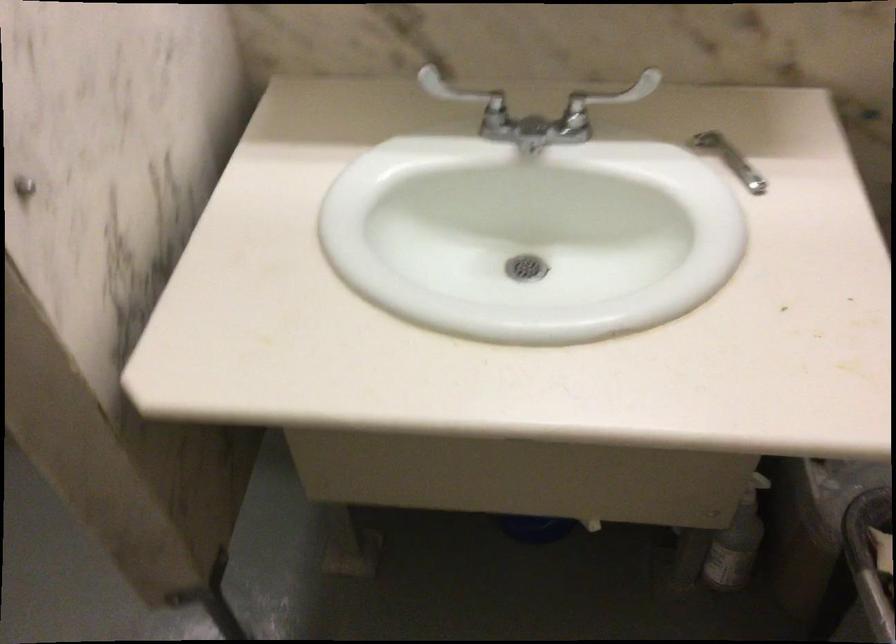
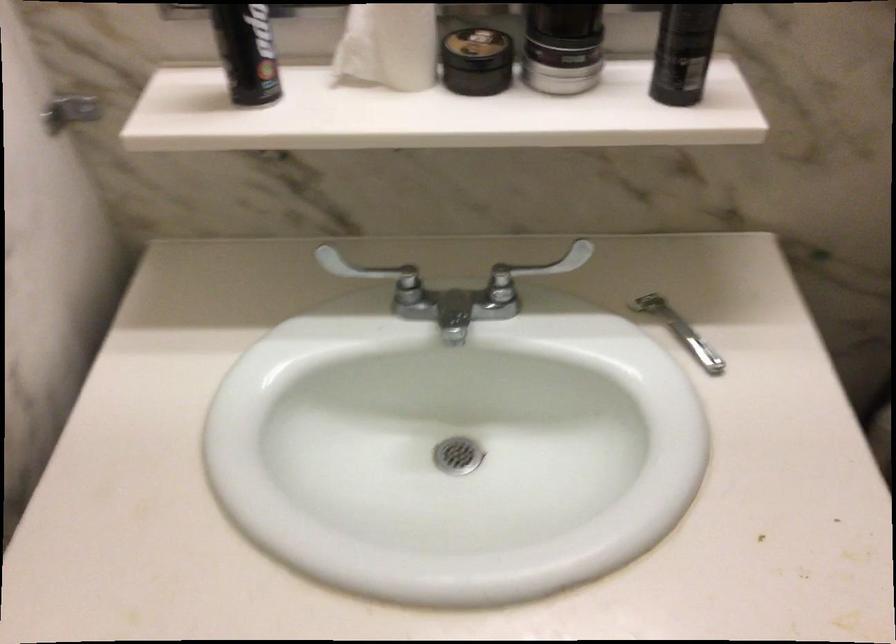
In the second image, find the point that corresponds to pixel 462 109 in the first image.

(375, 275)